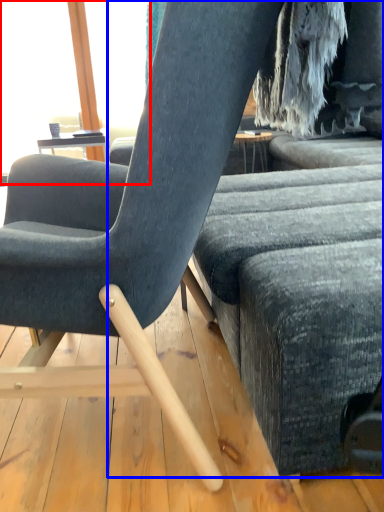
Question: Among these objects, which one is farthest to the camera, window screen (highlighted by a red box) or studio couch (highlighted by a blue box)?

Choices:
 (A) window screen
 (B) studio couch

Answer: (A)